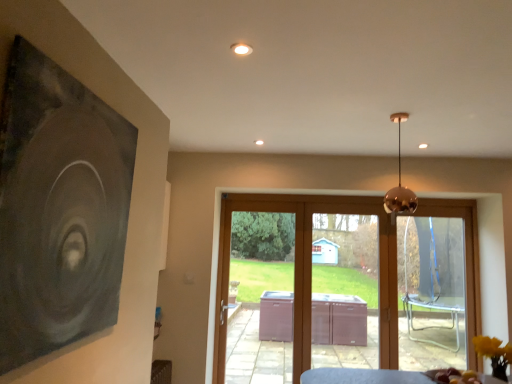
Question: Considering the relative sizes of copper reflective pendant light at upper center and brown wooden door at center in the image provided, is copper reflective pendant light at upper center smaller than brown wooden door at center?

Choices:
 (A) no
 (B) yes

Answer: (B)

Question: Is copper reflective pendant light at upper center located outside brown wooden door at center?

Choices:
 (A) yes
 (B) no

Answer: (A)

Question: Considering the relative positions of copper reflective pendant light at upper center and brown wooden door at center in the image provided, is copper reflective pendant light at upper center behind brown wooden door at center?

Choices:
 (A) yes
 (B) no

Answer: (B)

Question: Is copper reflective pendant light at upper center placed right next to brown wooden door at center?

Choices:
 (A) no
 (B) yes

Answer: (A)

Question: Considering the relative sizes of copper reflective pendant light at upper center and brown wooden door at center in the image provided, is copper reflective pendant light at upper center wider than brown wooden door at center?

Choices:
 (A) no
 (B) yes

Answer: (B)

Question: From the image's perspective, is copper reflective pendant light at upper center under brown wooden door at center?

Choices:
 (A) no
 (B) yes

Answer: (A)

Question: From a real-world perspective, is dark matte painting at left positioned under brown wooden door at center based on gravity?

Choices:
 (A) yes
 (B) no

Answer: (B)

Question: Considering the relative sizes of dark matte painting at left and brown wooden door at center in the image provided, is dark matte painting at left thinner than brown wooden door at center?

Choices:
 (A) yes
 (B) no

Answer: (A)

Question: Is dark matte painting at left at the left side of brown wooden door at center?

Choices:
 (A) no
 (B) yes

Answer: (B)

Question: Is dark matte painting at left surrounding brown wooden door at center?

Choices:
 (A) no
 (B) yes

Answer: (A)

Question: From the image's perspective, does dark matte painting at left appear higher than brown wooden door at center?

Choices:
 (A) yes
 (B) no

Answer: (A)

Question: Is dark matte painting at left bigger than brown wooden door at center?

Choices:
 (A) no
 (B) yes

Answer: (A)

Question: Considering the relative sizes of brown wooden door at center and brown wood screen door at center in the image provided, is brown wooden door at center shorter than brown wood screen door at center?

Choices:
 (A) yes
 (B) no

Answer: (A)